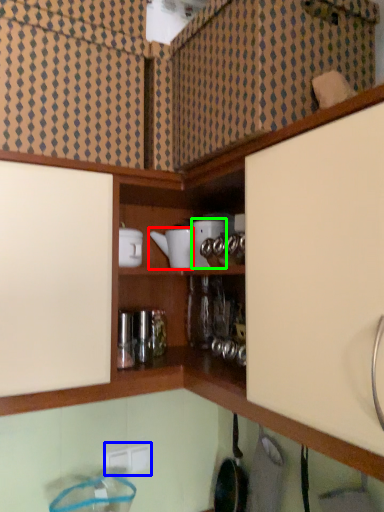
Question: Which object is positioned farthest from appliance (highlighted by a red box)? Select from electric outlet (highlighted by a blue box) and appliance (highlighted by a green box).

Choices:
 (A) electric outlet
 (B) appliance

Answer: (A)